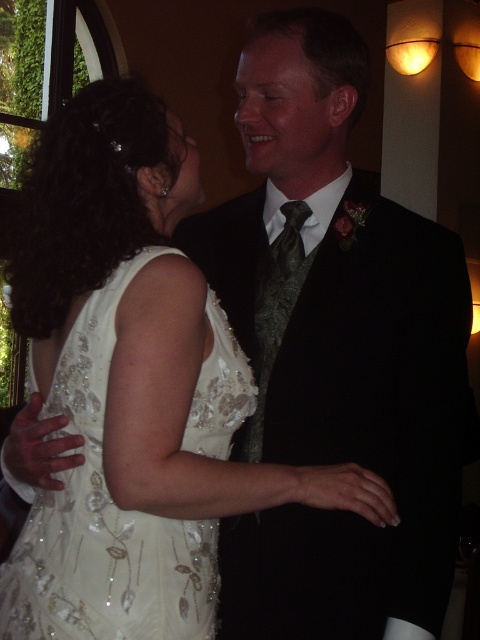
Can you confirm if black satin suit at center is positioned above white sequined dress at center?

Correct, black satin suit at center is located above white sequined dress at center.

Is black satin suit at center bigger than white sequined dress at center?

Yes, black satin suit at center is bigger than white sequined dress at center.

Is point (462, 403) positioned after point (169, 506)?

Yes, point (462, 403) is behind point (169, 506).

The width and height of the screenshot is (480, 640). In order to click on black satin suit at center in this screenshot , I will do `click(336, 353)`.

Between black satin suit at center and green satin tie at center, which one has more height?

black satin suit at center

Between point (243, 435) and point (268, 369), which one is positioned in front?

Point (268, 369)

Identify the location of black satin suit at center. The height and width of the screenshot is (640, 480). (336, 353).

Which is in front, point (154, 138) or point (74, 582)?

Point (74, 582)

Is point (294, 481) less distant than point (94, 637)?

No.

This screenshot has width=480, height=640. Identify the location of white sequined dress at center. (95, 208).

Locate an element on the screen. white sequined dress at center is located at coordinates (95, 208).